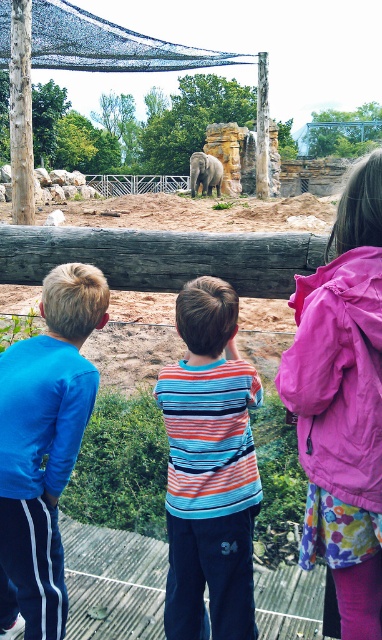
You are a zookeeper planning to place a new sign between the pink fabric jacket at upper right and the blue track pants at left. Which object should the sign be closer to if the sign needs to be placed closer to the narrower object?

The pink fabric jacket at upper right has a lesser width compared to blue track pants at left, so the sign should be placed closer to the pink fabric jacket at upper right.

You are a zookeeper trying to determine which of the two points, point [312,531] or point [208,246], is closer to the visitors on the wooden platform. Based on the scene, which point is closer?

Point [312,531] is closer to the viewer than point [208,246], so it is closer to the visitors on the wooden platform.

You are a zookeeper trying to determine the best position to place a new feeding station for the elephant. The feeding station needs to be accessible to both the child in the pink fabric jacket at upper right and the child in the blue track pants at left. Considering their positions, which child is positioned higher up and would require the feeding station to be placed at a higher elevation?

The pink fabric jacket at upper right is much taller than the blue track pants at left, so the feeding station should be placed at a higher elevation to accommodate the child in the pink fabric jacket at upper right.